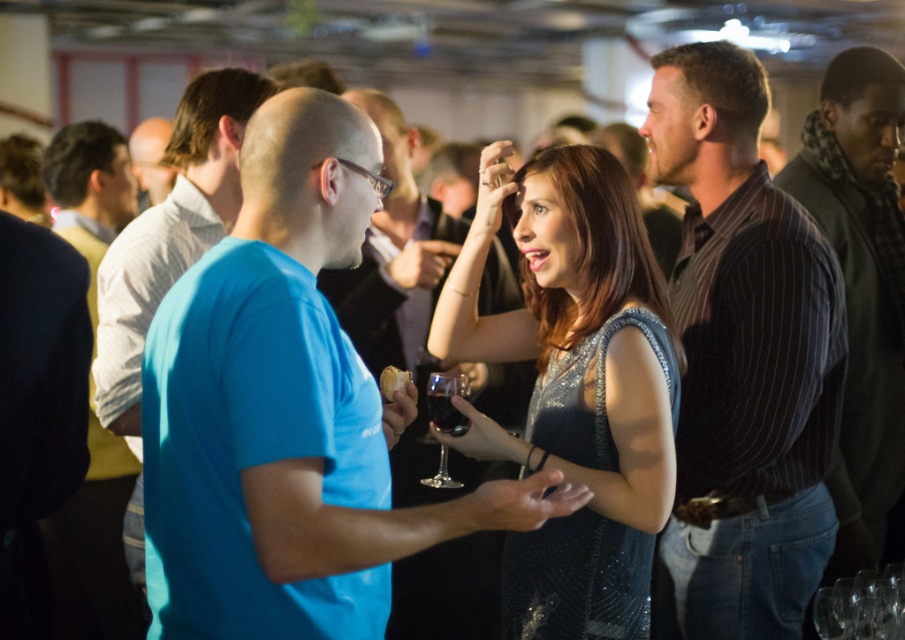
Question: Can you confirm if striped cotton shirt at right is smaller than matte blue shirt at center?

Choices:
 (A) yes
 (B) no

Answer: (B)

Question: Which point appears closest to the camera in this image?

Choices:
 (A) pos(855,356)
 (B) pos(401,563)
 (C) pos(599,356)
 (D) pos(748,198)

Answer: (C)

Question: Does dark gray pinstripe shirt at right appear on the right side of matte blue t-shirt at center?

Choices:
 (A) yes
 (B) no

Answer: (A)

Question: Among these objects, which one is farthest from the camera?

Choices:
 (A) blue matte t-shirt at center
 (B) blue shirt at left

Answer: (B)

Question: Which of the following is the farthest from the observer?

Choices:
 (A) (62, 540)
 (B) (446, 419)
 (C) (407, 147)
 (D) (759, 531)

Answer: (C)

Question: Is sparkly blue dress at center in front of dark gray pinstripe shirt at right?

Choices:
 (A) yes
 (B) no

Answer: (A)